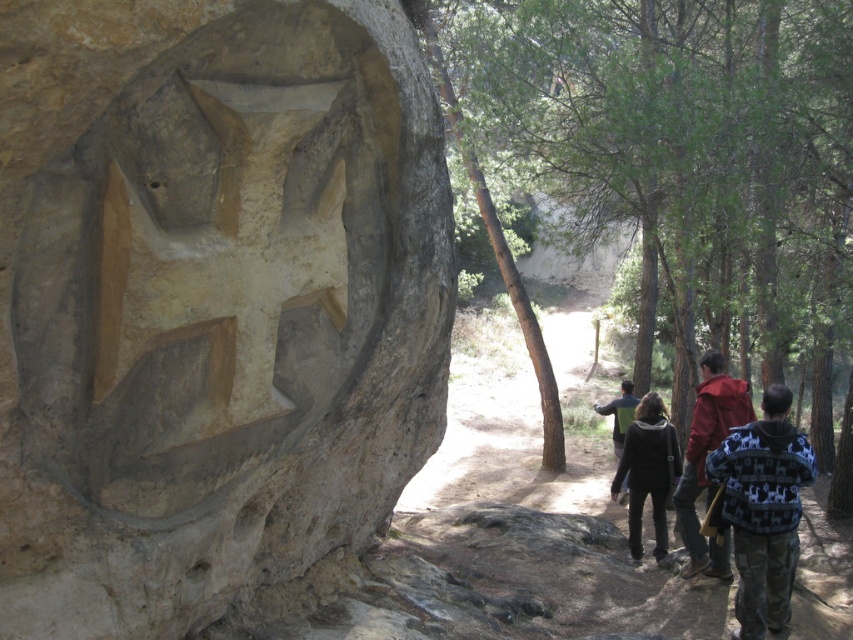
You are a hiker standing on the dirt path and want to take a photo of both the natural stone carving at center and the green leafy tree at center. Which object should you focus on first if you want to capture both in the same frame without moving your camera?

The natural stone carving at center is not as tall as the green leafy tree at center, so you should focus on the natural stone carving at center first to ensure both fit in the frame.

You are standing at the rock formation and want to take a photo of the carved face. There is a knitted sweater at right. Where is the point at coordinates point (763, 509) located?

The point at coordinates point (763, 509) is located on the knitted sweater at right.